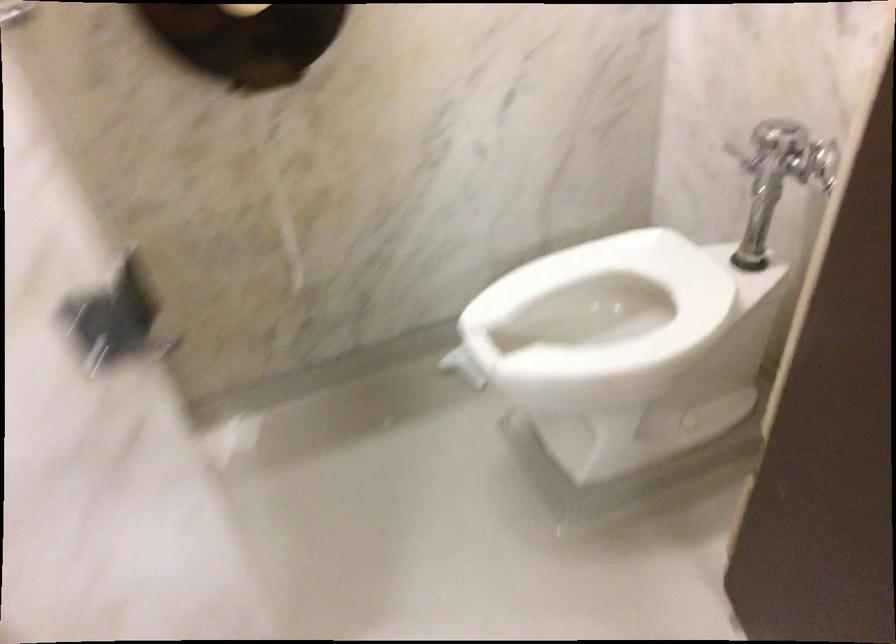
Image resolution: width=896 pixels, height=644 pixels. What are the coordinates of `toilet flush handle` in the screenshot? It's located at (821, 161).